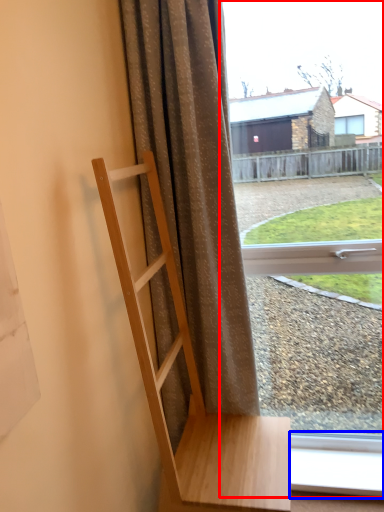
Question: Which object appears farthest to the camera in this image, window (highlighted by a red box) or window frame (highlighted by a blue box)?

Choices:
 (A) window
 (B) window frame

Answer: (B)